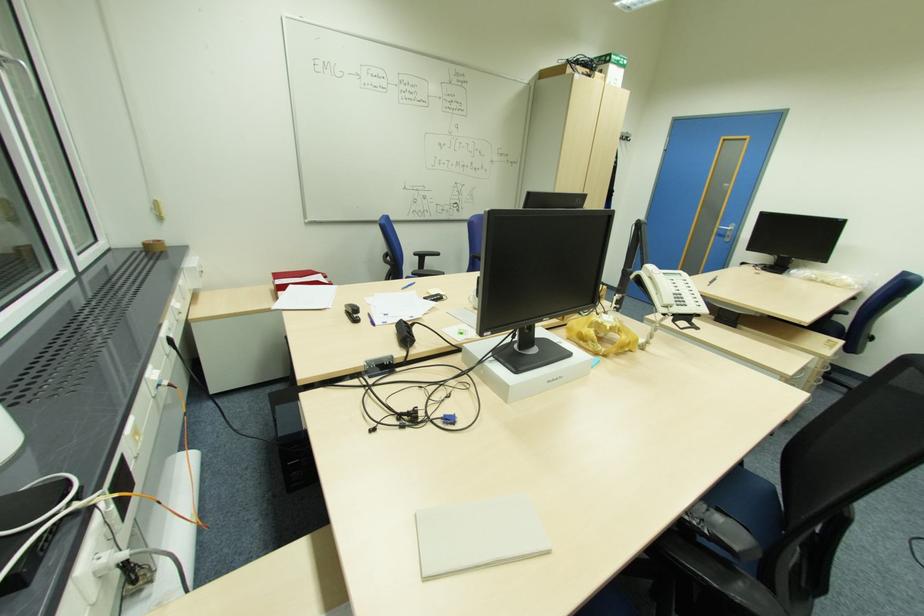
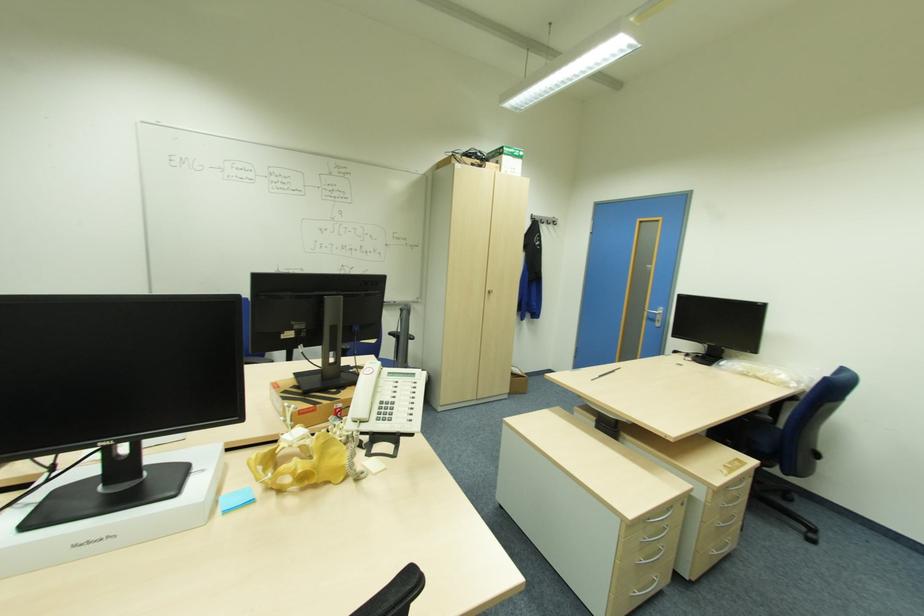
Where in the second image is the point corresponding to (x=608, y=355) from the first image?

(283, 490)